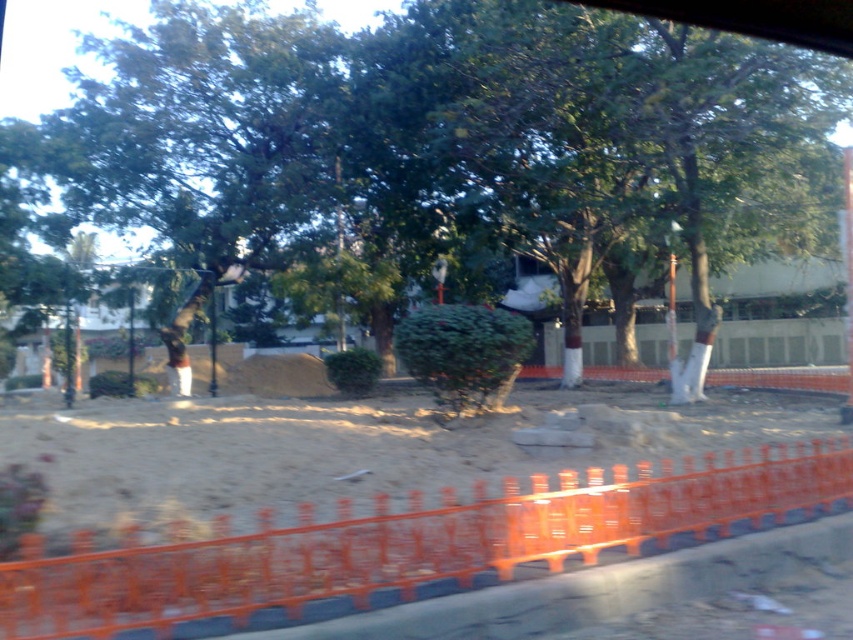
You are standing at the point with coordinates point (x=412, y=545) in the image. What object are you standing on?

The point (x=412, y=545) corresponds to the orange plastic barricade at lower center.

You are driving a car and see the orange plastic barricade at lower center and the green leafy tree at center. Which object is closer to you from your perspective in the car?

The orange plastic barricade at lower center is closer to you because it is located below the green leafy tree at center, indicating it is in the foreground of the scene.